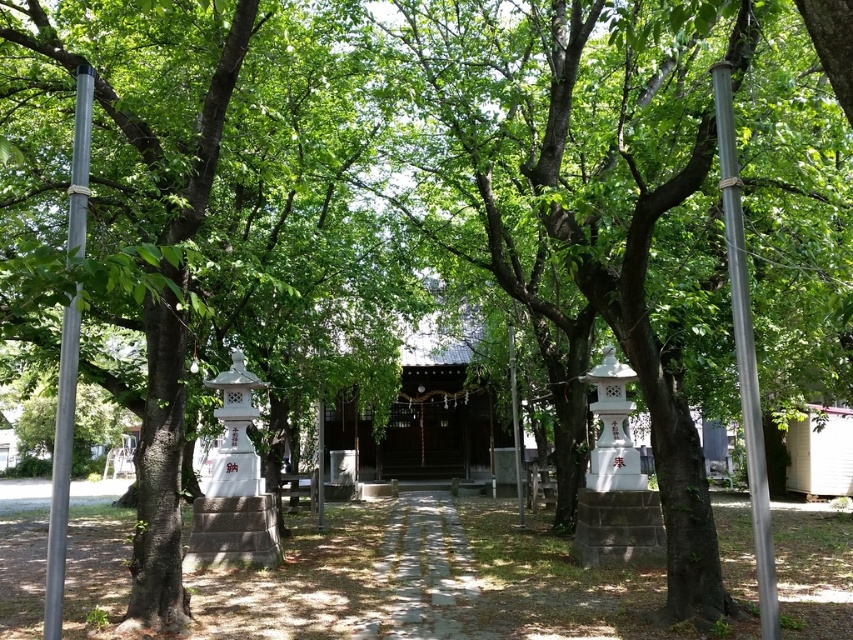
You are standing at the entrance of the shrine and notice a point marked at coordinates (746, 353). What object is located at this point?

The point at coordinates (746, 353) corresponds to the metallic gray pole at right.

You are standing at the entrance of the shrine and notice two metallic poles. One is the metallic gray pole at right and the other is the metallic pole at center. Which pole is closer to you?

The metallic gray pole at right is in front of the metallic pole at center, so it is closer to you.